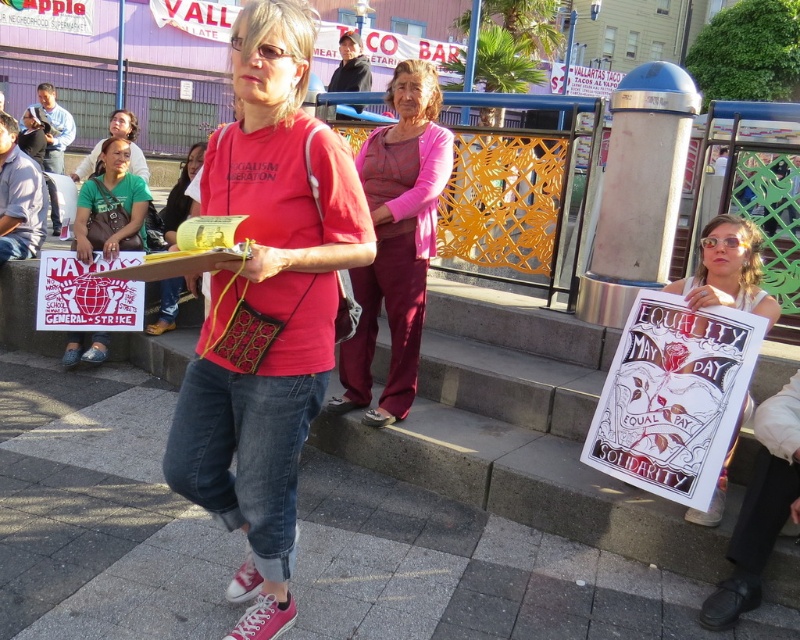
Is white paper poster at right shorter than matte yellow purse at center?

Yes, white paper poster at right is shorter than matte yellow purse at center.

Which is behind, point (724, 301) or point (150, 333)?

The point (150, 333) is behind.

I want to click on white paper poster at right, so click(x=728, y=269).

Consider the image. Which of these two, matte red t-shirt at center or green fabric shirt at lower left, stands shorter?

green fabric shirt at lower left

Consider the image. Between matte red t-shirt at center and green fabric shirt at lower left, which one appears on the right side from the viewer's perspective?

matte red t-shirt at center

Which is behind, point (348, 244) or point (78, 240)?

Positioned behind is point (78, 240).

The height and width of the screenshot is (640, 800). In order to click on matte red t-shirt at center in this screenshot , I will do `click(266, 307)`.

Looking at this image, can you confirm if matte red t-shirt at center is shorter than matte yellow purse at center?

No, matte red t-shirt at center is not shorter than matte yellow purse at center.

This screenshot has height=640, width=800. What do you see at coordinates (266, 307) in the screenshot?
I see `matte red t-shirt at center` at bounding box center [266, 307].

Locate an element on the screen. The height and width of the screenshot is (640, 800). matte red t-shirt at center is located at coordinates (266, 307).